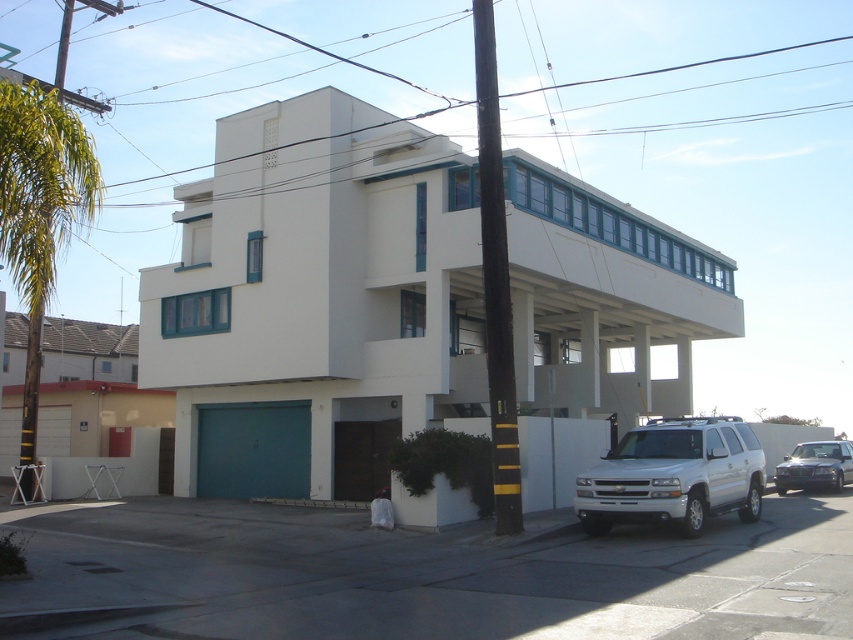
Question: Which of the following is the closest to the observer?

Choices:
 (A) green leafy palm tree at left
 (B) metallic silver sedan at lower right

Answer: (A)

Question: Which of these objects is positioned farthest from the green leafy palm tree at left?

Choices:
 (A) metallic silver sedan at lower right
 (B) white glossy suv at lower right

Answer: (A)

Question: Does white glossy suv at lower right come in front of metallic silver sedan at lower right?

Choices:
 (A) yes
 (B) no

Answer: (A)

Question: Can you confirm if green leafy palm tree at left is bigger than metallic silver sedan at lower right?

Choices:
 (A) yes
 (B) no

Answer: (A)

Question: Among these objects, which one is nearest to the camera?

Choices:
 (A) white glossy suv at lower right
 (B) metallic silver sedan at lower right

Answer: (A)

Question: Is green leafy palm tree at left wider than metallic silver sedan at lower right?

Choices:
 (A) no
 (B) yes

Answer: (B)